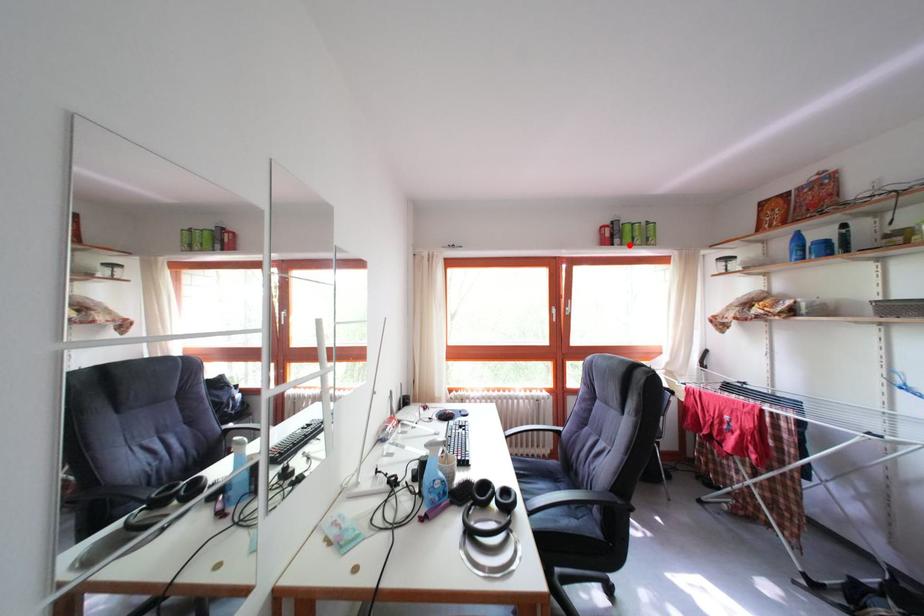
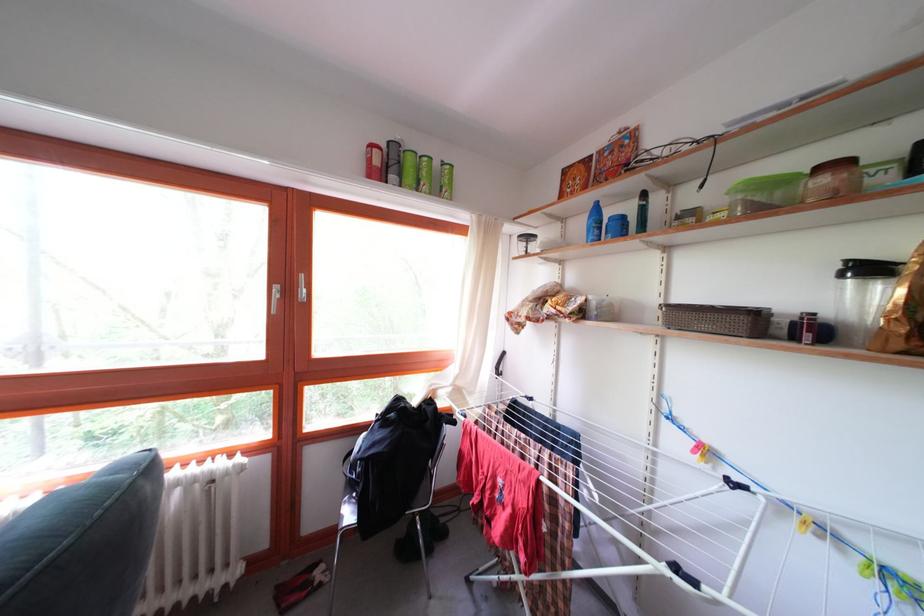
Locate, in the second image, the point that corresponds to the highlighted location in the first image.

(409, 180)